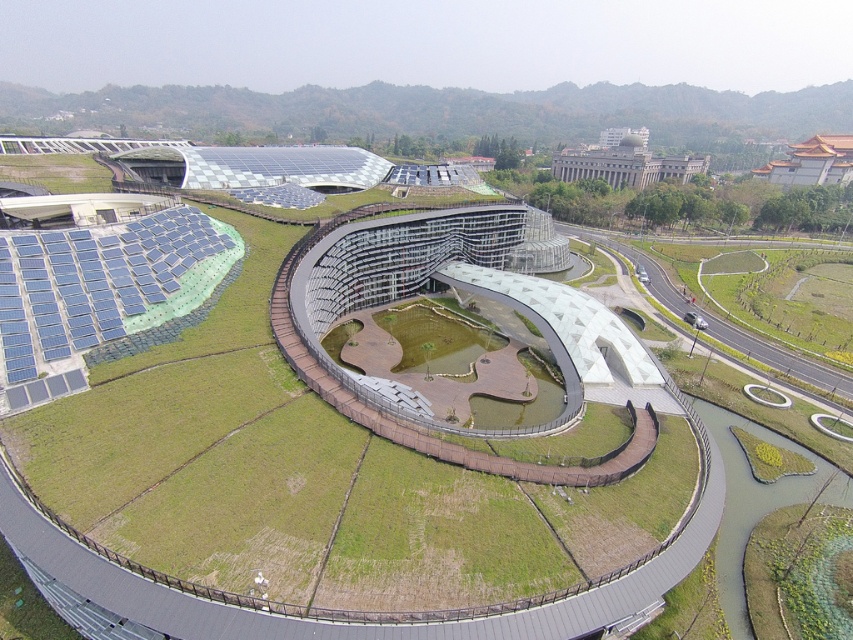
Question: Is green grass at center wider than white stone building at upper right?

Choices:
 (A) yes
 (B) no

Answer: (B)

Question: Does white stone building at upper right come behind yellow/golden tile roof at upper right?

Choices:
 (A) yes
 (B) no

Answer: (B)

Question: Can you confirm if green grass at center is thinner than yellow/golden tile roof at upper right?

Choices:
 (A) yes
 (B) no

Answer: (B)

Question: Considering the real-world distances, which object is farthest from the yellow/golden tile roof at upper right?

Choices:
 (A) green grass at center
 (B) white stone building at upper right

Answer: (A)

Question: Among these objects, which one is farthest from the camera?

Choices:
 (A) white stone building at upper right
 (B) green grass at center

Answer: (A)

Question: Which point is farther to the camera?

Choices:
 (A) pos(689,176)
 (B) pos(618,352)
 (C) pos(793,172)

Answer: (C)